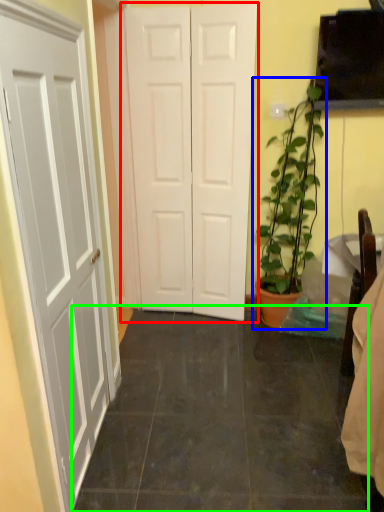
Question: Which object is positioned farthest from door (highlighted by a red box)? Select from houseplant (highlighted by a blue box) and tile (highlighted by a green box).

Choices:
 (A) houseplant
 (B) tile

Answer: (B)